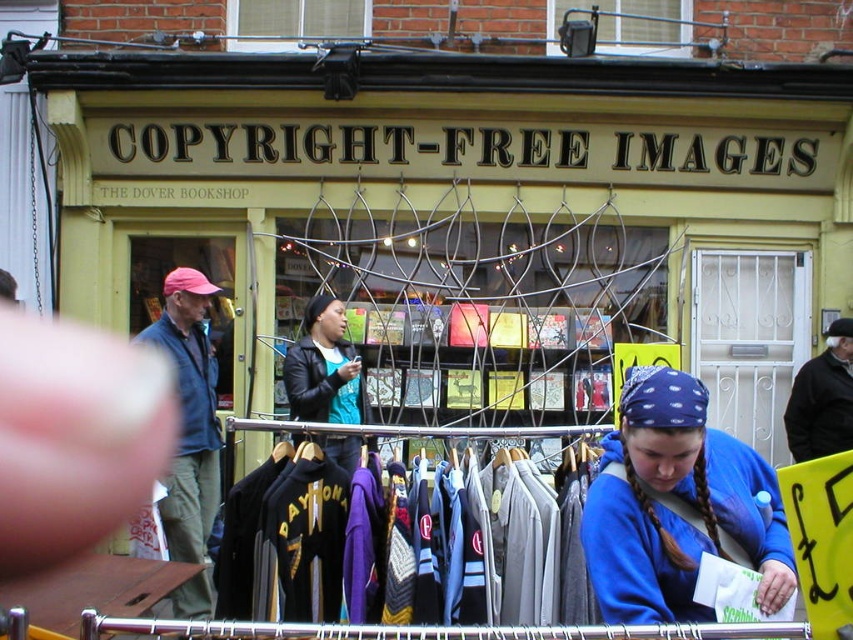
Question: Among these objects, which one is farthest from the camera?

Choices:
 (A) black leather jacket at upper right
 (B) black fleece sweatshirt at center

Answer: (A)

Question: Among these objects, which one is nearest to the camera?

Choices:
 (A) blue fleece sweatshirt at lower right
 (B) black fleece sweatshirt at center
 (C) leather jacket at center

Answer: (A)

Question: Can you confirm if metallic wire mesh at center is wider than blue fleece sweatshirt at lower right?

Choices:
 (A) no
 (B) yes

Answer: (B)

Question: Is black fleece sweatshirt at center bigger than denim jacket at left?

Choices:
 (A) yes
 (B) no

Answer: (A)

Question: Does black fleece sweatshirt at center have a larger size compared to blue fleece sweatshirt at lower right?

Choices:
 (A) yes
 (B) no

Answer: (A)

Question: Estimate the real-world distances between objects in this image. Which object is farther from the metallic wire mesh at center?

Choices:
 (A) blue fleece sweatshirt at lower right
 (B) leather jacket at center
 (C) denim jacket at left

Answer: (A)